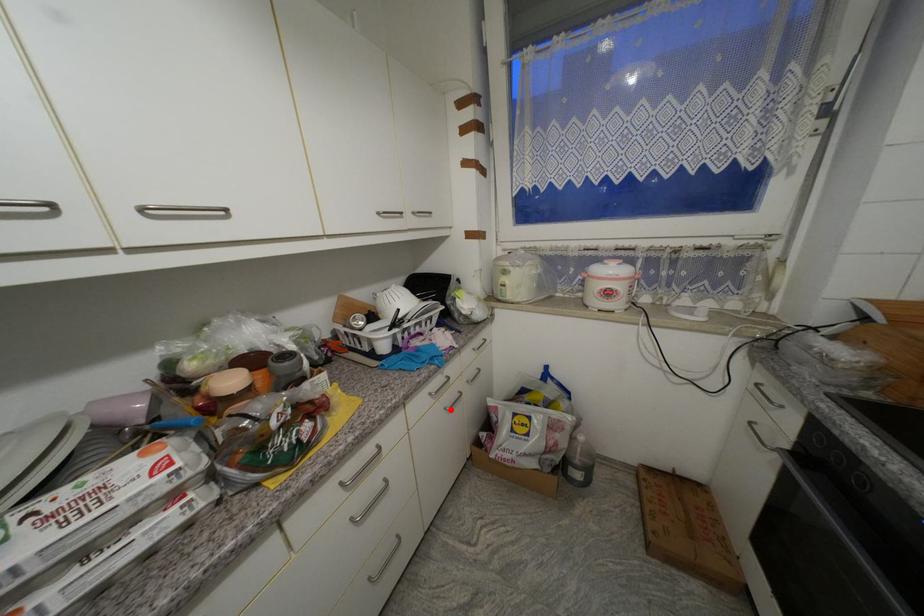
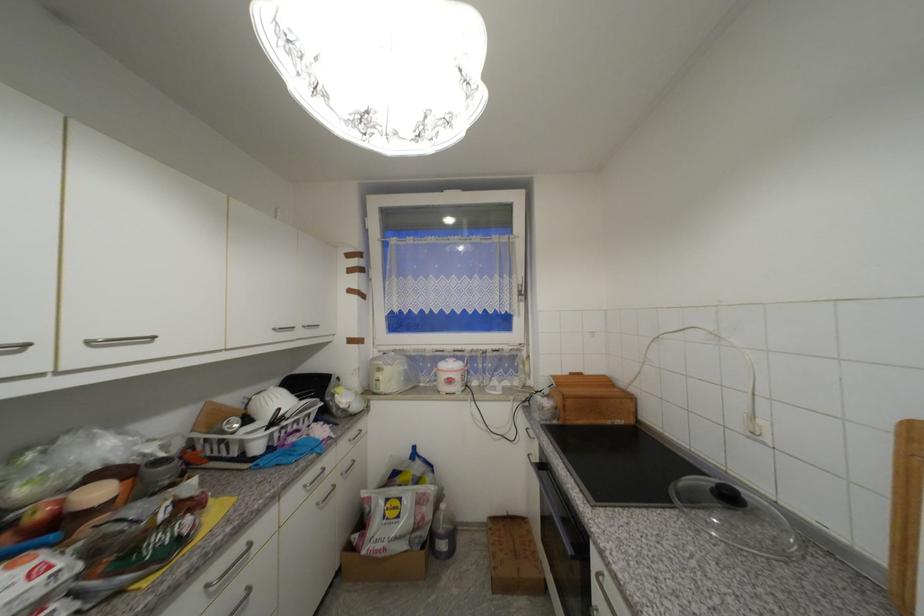
Find the pixel in the second image that matches the highlighted location in the first image.

(322, 505)